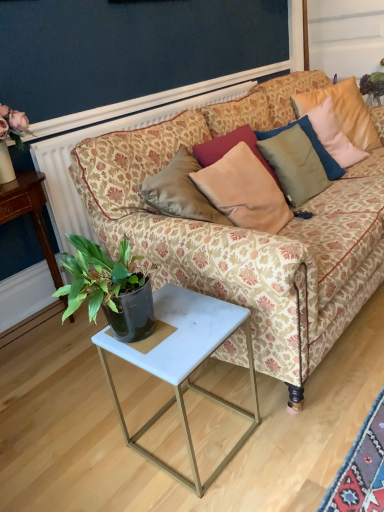
What are the coordinates of `vacant space underneath white marble side table at lower center (from a real-world perspective)` in the screenshot? It's located at (195, 435).